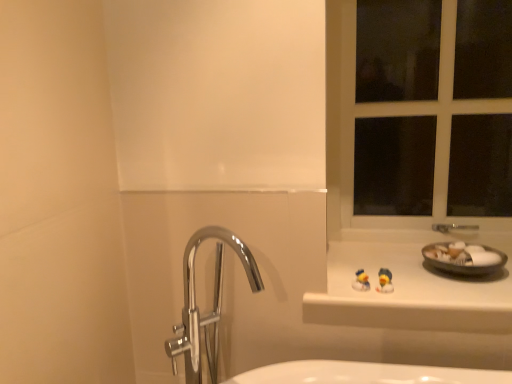
This screenshot has width=512, height=384. What are the coordinates of `vacant area on top of white glossy counter top at upper right (from a real-world perspective)` in the screenshot? It's located at pyautogui.click(x=407, y=273).